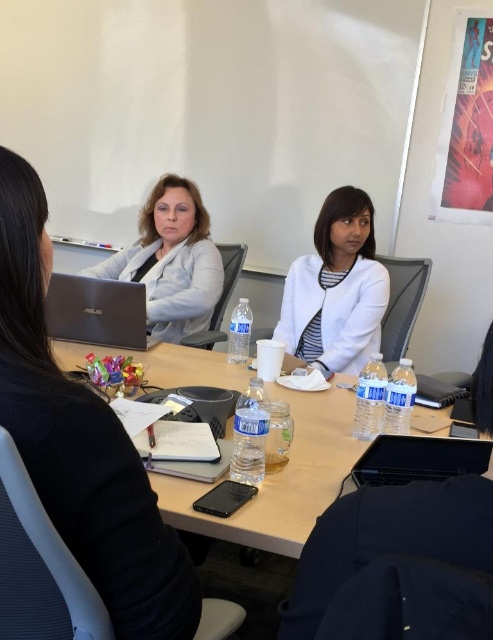
Question: Which object is farther from the camera taking this photo?

Choices:
 (A) white matte jacket at center
 (B) silver metallic laptop at lower left

Answer: (A)

Question: Among these points, which one is farthest from the camera?

Choices:
 (A) (479, 456)
 (B) (241, 371)
 (C) (63, 296)
 (D) (377, 260)

Answer: (D)

Question: Observing the image, what is the correct spatial positioning of white matte jacket at center in reference to silver metallic laptop at lower left?

Choices:
 (A) above
 (B) below

Answer: (A)

Question: Among these points, which one is farthest from the camera?

Choices:
 (A) (352, 472)
 (B) (319, 314)
 (C) (167, 304)

Answer: (C)

Question: Can you confirm if matte white jacket at center is positioned above silver metallic laptop at lower left?

Choices:
 (A) no
 (B) yes

Answer: (B)

Question: Does white matte jacket at center have a larger size compared to matte white jacket at center?

Choices:
 (A) no
 (B) yes

Answer: (A)